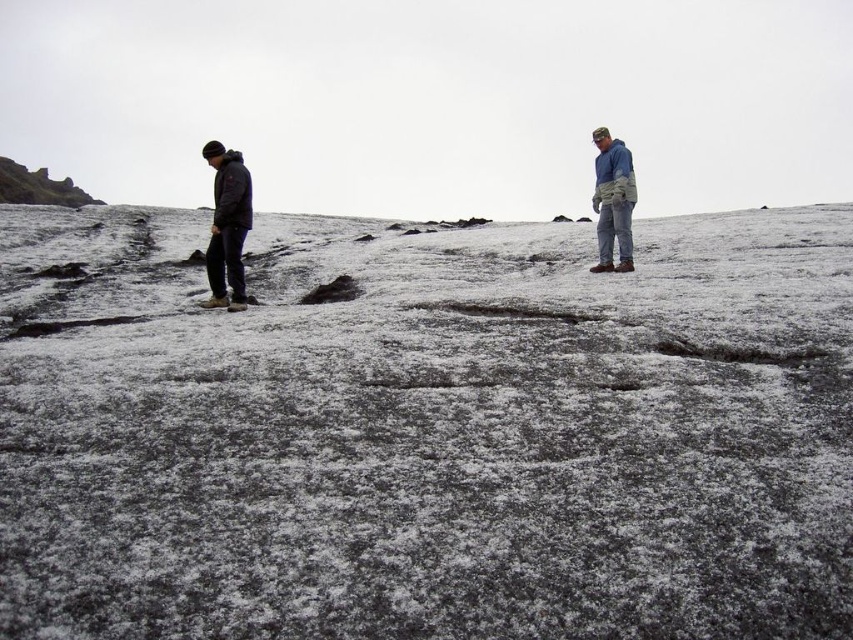
You are navigating a snowy terrain and need to locate the blue fleece jacket at right. According to the coordinates provided, where exactly is it positioned?

The blue fleece jacket at right is located at point (612, 200), which means it is positioned approximately one third from the left edge and two thirds from the bottom edge of the image.

You are standing on a snowy field with two people observing something. There is a point marked at coordinates (79, 449). If you want to reach that point quickly, which direction should you move in relation to the two people?

The point marked at coordinates (79, 449) is 7.34 meters away from the viewer, so you should move towards it directly, considering the two people are standing on the same snowy field.